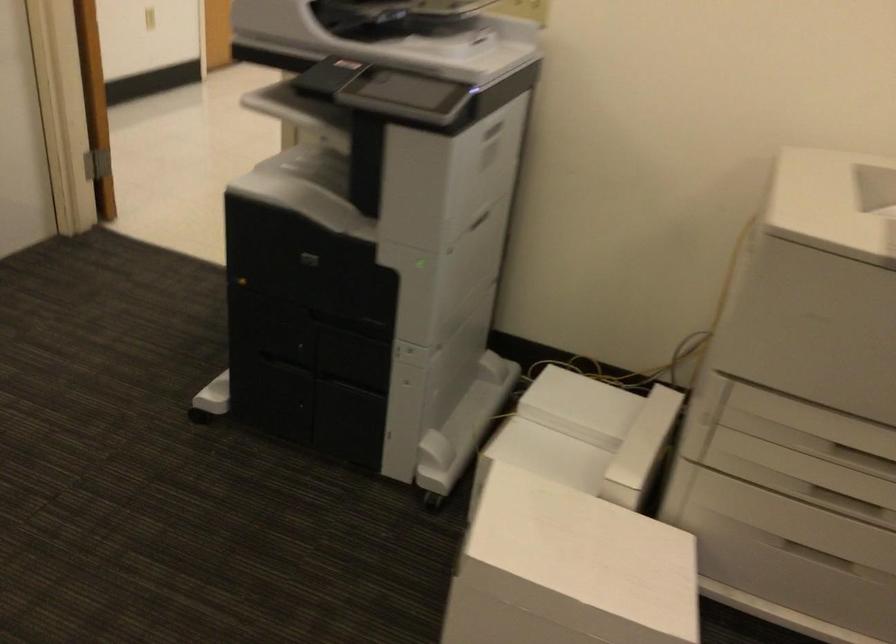
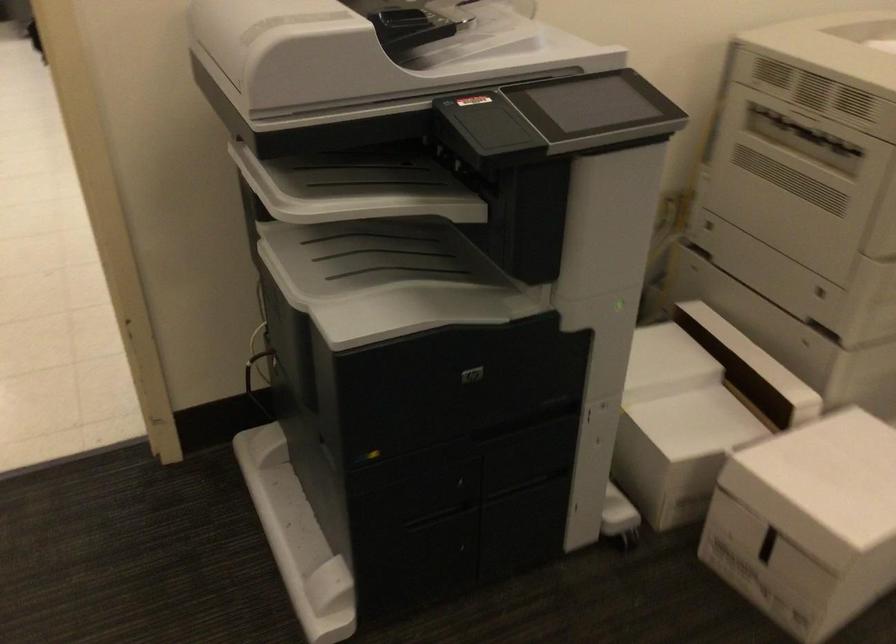
Where in the second image is the point corresponding to pixel 476 526 from the first image?

(807, 522)